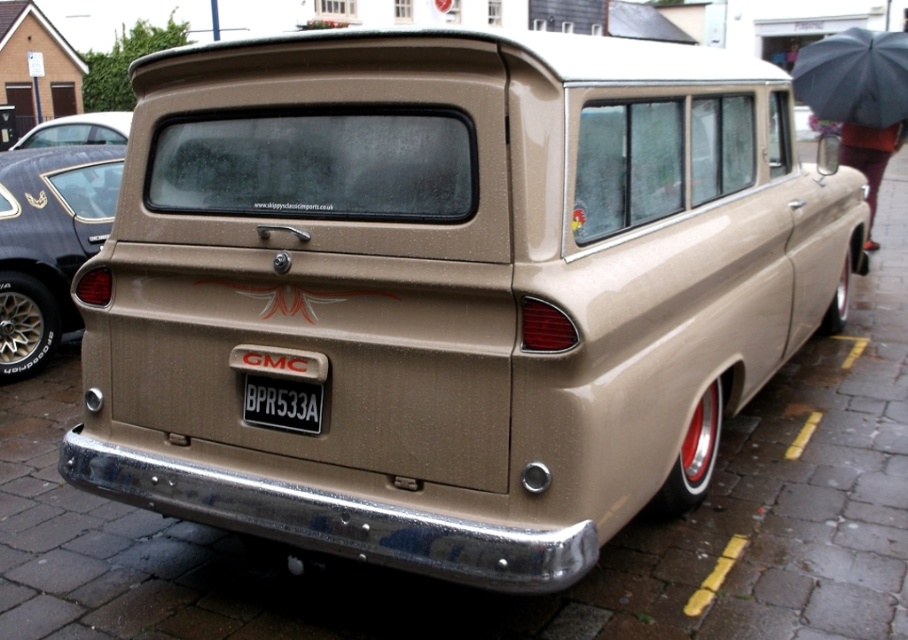
Question: Can you confirm if black matte umbrella at upper right is bigger than matte black car at upper left?

Choices:
 (A) no
 (B) yes

Answer: (B)

Question: Estimate the real-world distances between objects in this image. Which object is farther from the black plastic license plate at center?

Choices:
 (A) matte gold van at center
 (B) matte black car at upper left
 (C) black matte umbrella at upper right

Answer: (B)

Question: Which object is the closest to the black plastic license plate at center?

Choices:
 (A) matte black car at upper left
 (B) black matte umbrella at upper right

Answer: (B)

Question: Does black matte umbrella at upper right appear on the left side of black plastic license plate at center?

Choices:
 (A) yes
 (B) no

Answer: (B)

Question: Which point is closer to the camera?

Choices:
 (A) matte gold van at center
 (B) black plastic license plate at center

Answer: (B)

Question: Considering the relative positions of matte gold van at center and black plastic license plate at center in the image provided, where is matte gold van at center located with respect to black plastic license plate at center?

Choices:
 (A) below
 (B) above

Answer: (B)